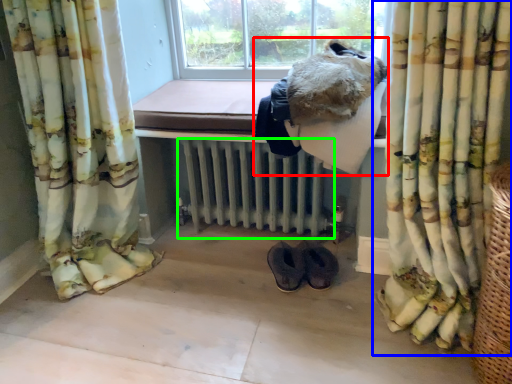
Question: Which object is positioned closest to animal (highlighted by a red box)? Select from curtain (highlighted by a blue box) and radiator (highlighted by a green box).

Choices:
 (A) curtain
 (B) radiator

Answer: (A)